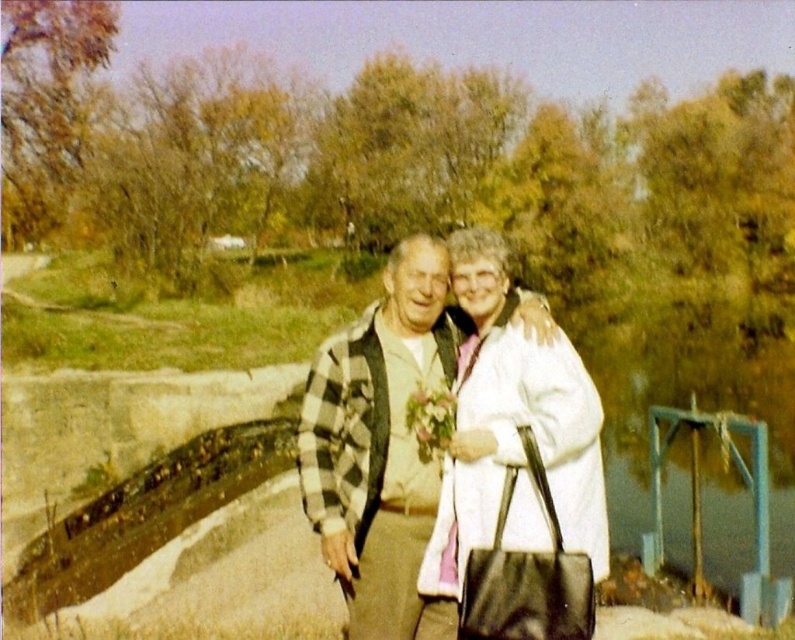
Question: Is matte black jacket at center bigger than pastel floral bouquet at center?

Choices:
 (A) no
 (B) yes

Answer: (B)

Question: Does matte black jacket at center have a greater width compared to pastel floral bouquet at center?

Choices:
 (A) no
 (B) yes

Answer: (B)

Question: Is matte black jacket at center in front of pastel floral bouquet at center?

Choices:
 (A) no
 (B) yes

Answer: (B)